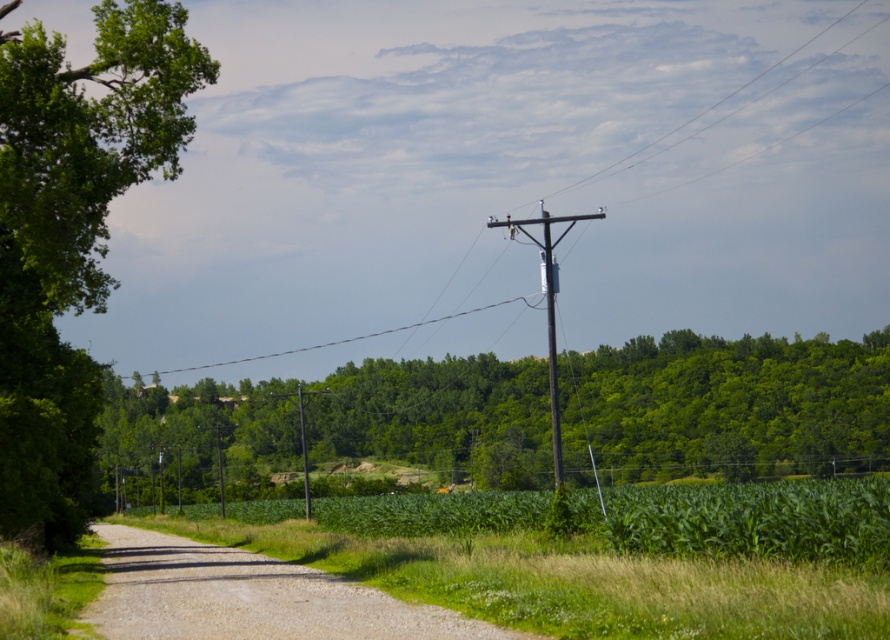
You are a painter setting up an easel to paint the two poles in the scene. Which pole, the metallic gray utility pole at center or the brown wooden pole at center, would you need to paint with more detail because it appears thinner?

The metallic gray utility pole at center is thinner than the brown wooden pole at center, so you would need to paint the metallic gray utility pole at center with more detail to capture its finer details accurately.

You are standing at the point marked as point (551, 344) in the image. Looking towards the road, which direction should you walk to reach the dense cluster of trees on the left side of the road?

The metallic gray utility pole at center is located at point (551, 344). Since the dense cluster of trees is on the left side of the road, you should walk towards the left side of the road from the metallic gray utility pole at center to reach them.

You are standing at the point marked by point (508, 180) on the image, which corresponds to the brown wooden pole at upper center. You want to walk towards the dense cluster of trees on the left side of the road. Is the path clear of obstacles between your current position and the trees?

The path between the brown wooden pole at upper center and the dense cluster of trees on the left side of the road is clear of obstacles as the scene describes the road bordered by lush greenery on both sides with no mention of obstacles between them.